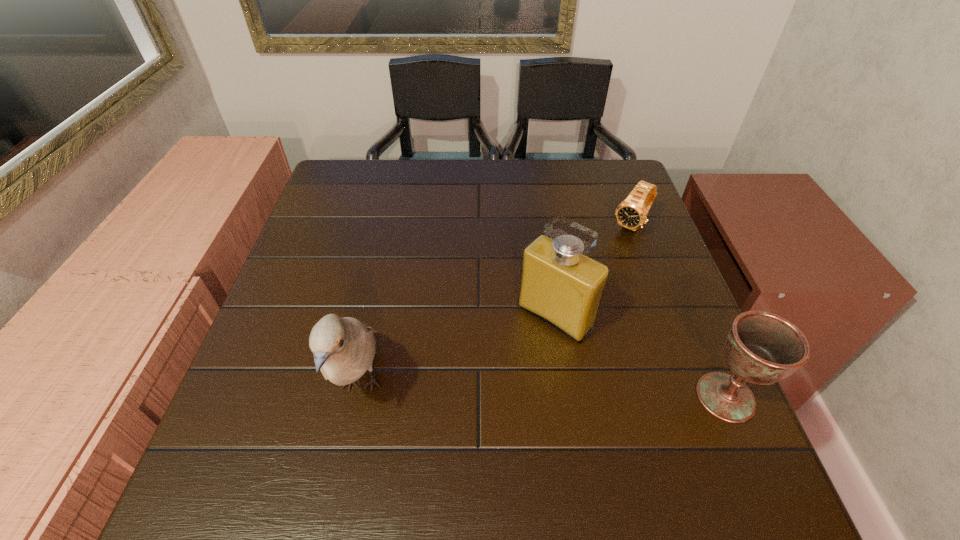
Choose which object is the third nearest neighbor to the shortest object. Please provide its 2D coordinates. Your answer should be formatted as a tuple, i.e. [(x, y)], where the tuple contains the x and y coordinates of a point satisfying the conditions above.

[(344, 348)]

This screenshot has width=960, height=540. I want to click on vacant space that satisfies the following two spatial constraints: 1. at the beak of the bird; 2. on the right side of the second shortest object, so click(x=359, y=397).

Find the location of a particular element. free region that satisfies the following two spatial constraints: 1. at the beak of the leftmost object; 2. on the right side of the chalice is located at coordinates (359, 397).

Locate an element on the screen. vacant region that satisfies the following two spatial constraints: 1. at the beak of the leftmost object; 2. on the right side of the chalice is located at coordinates (359, 397).

The image size is (960, 540). I want to click on vacant point that satisfies the following two spatial constraints: 1. at the beak of the leftmost object; 2. on the left side of the chalice, so click(x=359, y=397).

Where is `vacant space that satisfies the following two spatial constraints: 1. at the beak of the bird; 2. on the right side of the chalice`? vacant space that satisfies the following two spatial constraints: 1. at the beak of the bird; 2. on the right side of the chalice is located at coordinates pos(359,397).